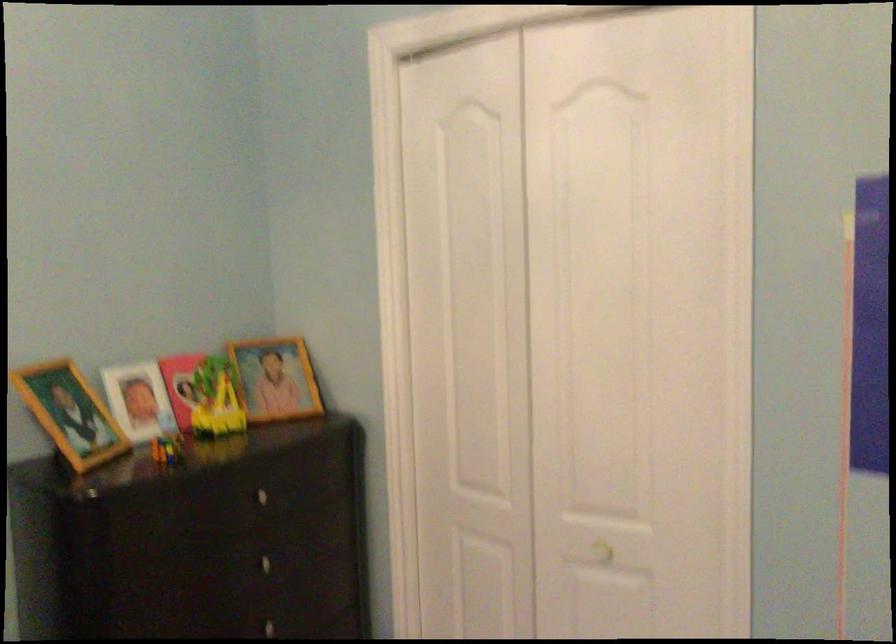
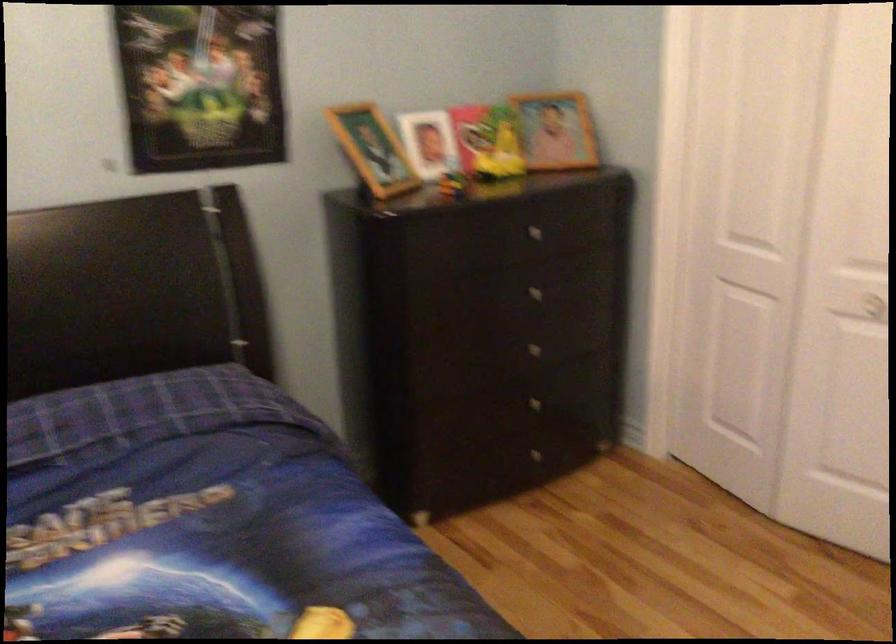
Question: The camera is either moving clockwise (left) or counter-clockwise (right) around the object. The first image is from the beginning of the video and the second image is from the end. Is the camera moving left or right when shooting the video?

Choices:
 (A) Left
 (B) Right

Answer: (B)